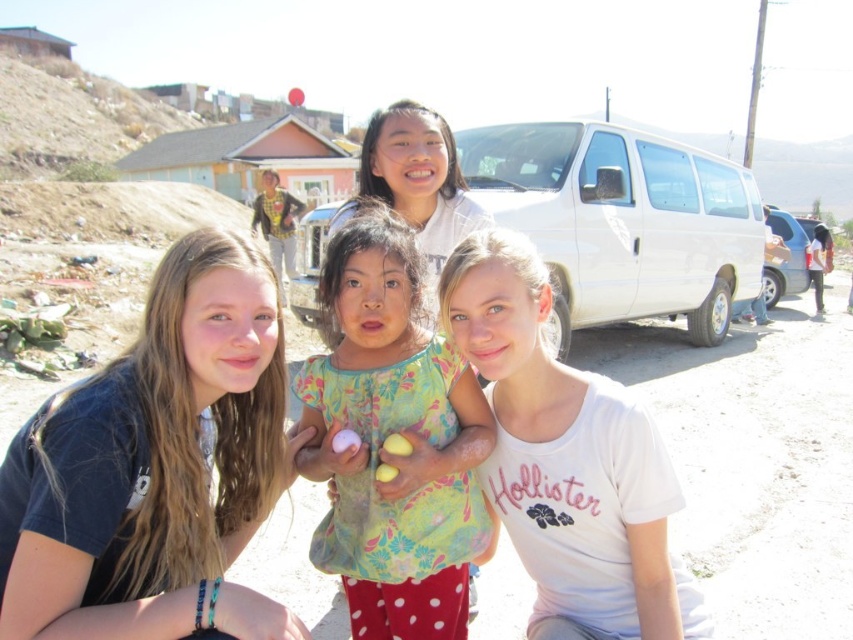
Which is in front, point (26, 476) or point (322, 547)?

Point (26, 476) is in front.

Which of these two, matte blue shirt at center or floral fabric dress at center, stands shorter?

matte blue shirt at center is shorter.

Measure the distance between matte blue shirt at center and camera.

matte blue shirt at center and camera are 6.56 feet apart from each other.

Where is `matte blue shirt at center`? Image resolution: width=853 pixels, height=640 pixels. matte blue shirt at center is located at coordinates (155, 467).

Between matte blue shirt at center and matte white shirt at center, which one appears on the right side from the viewer's perspective?

From the viewer's perspective, matte white shirt at center appears more on the right side.

Does point (242, 488) lie behind point (425, 141)?

No.

Does point (230, 461) lie in front of point (340, 211)?

Yes.

Where is `matte blue shirt at center`? The width and height of the screenshot is (853, 640). matte blue shirt at center is located at coordinates (155, 467).

Which is above, floral fabric dress at center or matte white shirt at center?

matte white shirt at center

Is point (387, 285) closer to camera compared to point (374, 186)?

Yes, point (387, 285) is in front of point (374, 186).

Locate an element on the screen. This screenshot has height=640, width=853. floral fabric dress at center is located at coordinates (390, 433).